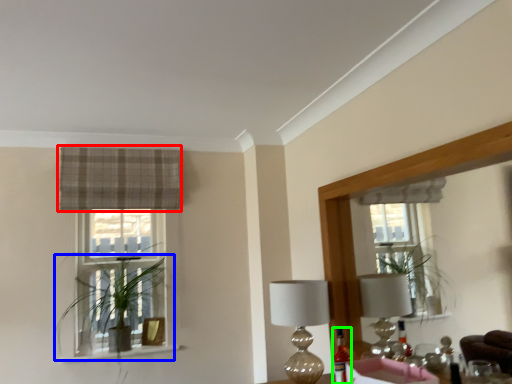
Question: Estimate the real-world distances between objects in this image. Which object is farther from curtain (highlighted by a red box), houseplant (highlighted by a blue box) or bottle (highlighted by a green box)?

Choices:
 (A) houseplant
 (B) bottle

Answer: (B)